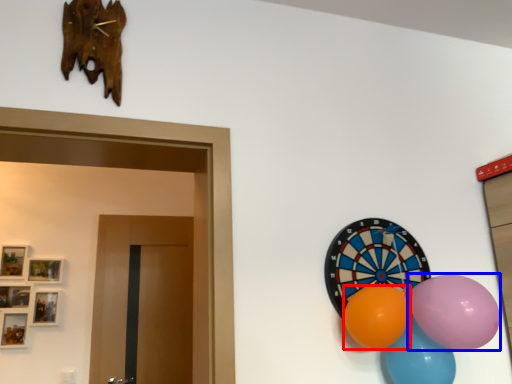
Question: Which object is closer to the camera taking this photo, balloon (highlighted by a red box) or balloon (highlighted by a blue box)?

Choices:
 (A) balloon
 (B) balloon

Answer: (B)